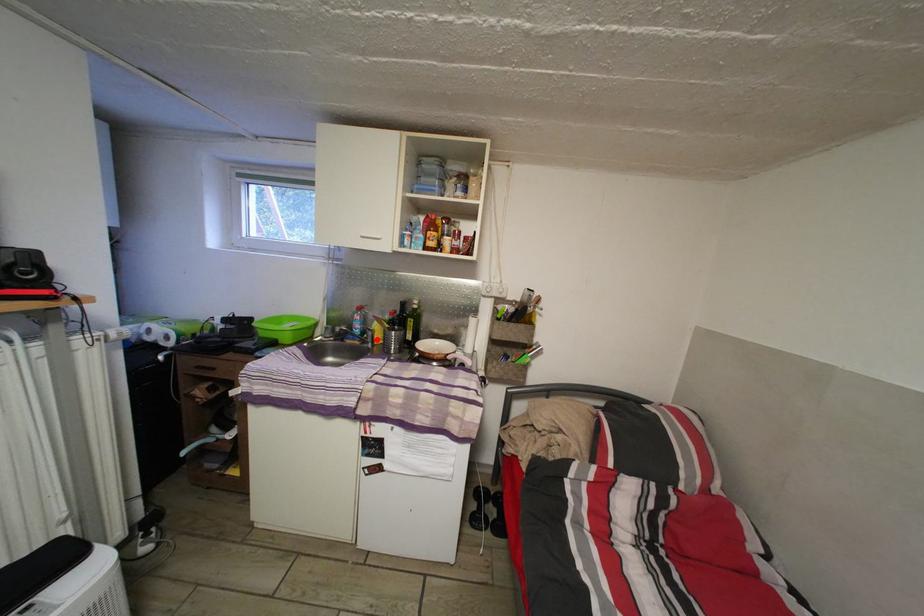
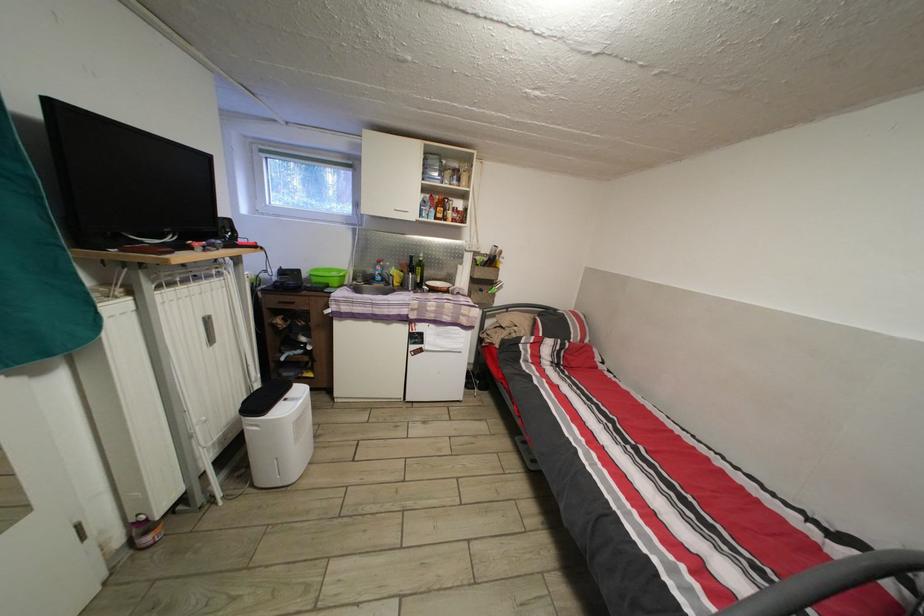
Where in the second image is the point corresponding to the highlighted location from the first image?

(398, 285)